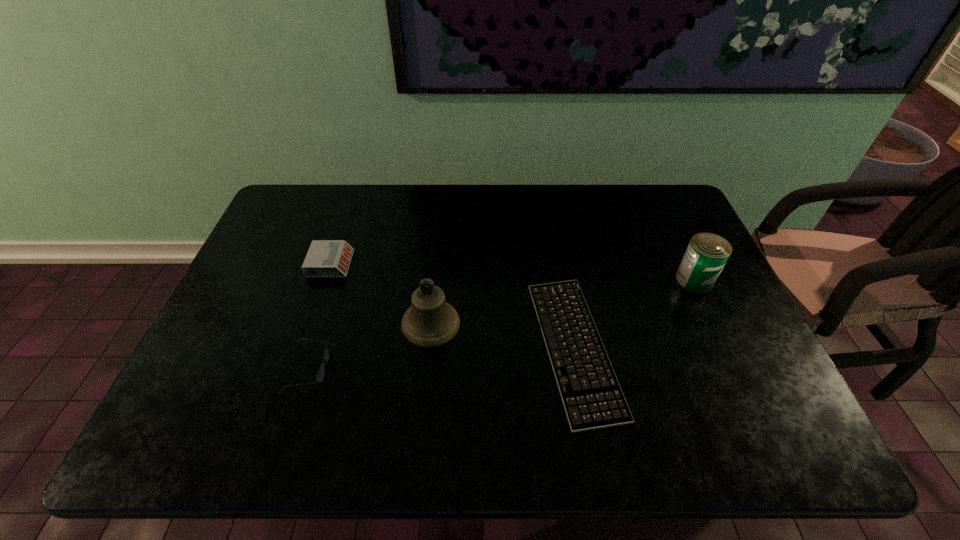
I want to click on bell, so click(430, 321).

You are a GUI agent. You are given a task and a screenshot of the screen. Output one action in this format:
    pyautogui.click(x=<x>, y=<y>)
    Task: Click on the third object from right to left
    
    Given the screenshot: What is the action you would take?
    pyautogui.click(x=430, y=321)

Identify the location of can. (707, 253).

Where is `the fourth shortest object`? the fourth shortest object is located at coordinates (707, 253).

This screenshot has height=540, width=960. In order to click on the third shortest object in this screenshot , I will do `click(326, 258)`.

The width and height of the screenshot is (960, 540). I want to click on sunglasses, so click(x=320, y=376).

This screenshot has height=540, width=960. I want to click on the second object from right to left, so [592, 397].

The height and width of the screenshot is (540, 960). What are the coordinates of `the shortest object` in the screenshot? It's located at (592, 397).

This screenshot has width=960, height=540. I want to click on vacant space situated on the right of the tallest object, so click(589, 323).

The image size is (960, 540). I want to click on vacant position located 0.180m on the front of the can, so click(725, 348).